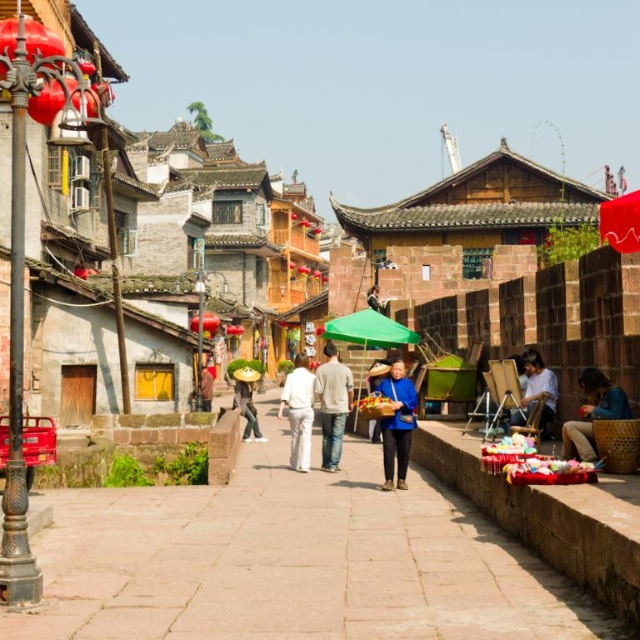
Question: Can you confirm if paved stone walkway at center is positioned below green straw hat at center?

Choices:
 (A) yes
 (B) no

Answer: (A)

Question: Can you confirm if light gray cotton sweater at center is bigger than white cotton pants at center?

Choices:
 (A) yes
 (B) no

Answer: (B)

Question: Which object appears closest to the camera in this image?

Choices:
 (A) light blue fabric at center
 (B) light gray cotton sweater at center
 (C) blue fabric basket at center

Answer: (C)

Question: Estimate the real-world distances between objects in this image. Which object is farther from the light gray cotton sweater at center?

Choices:
 (A) light blue fabric at center
 (B) blue fabric basket at center

Answer: (A)

Question: Is blue fabric basket at center smaller than dark blue fabric at center?

Choices:
 (A) no
 (B) yes

Answer: (A)

Question: Which of the following is the farthest from the observer?

Choices:
 (A) blue fabric basket at right
 (B) blue fabric basket at center
 (C) white cotton pants at center

Answer: (C)